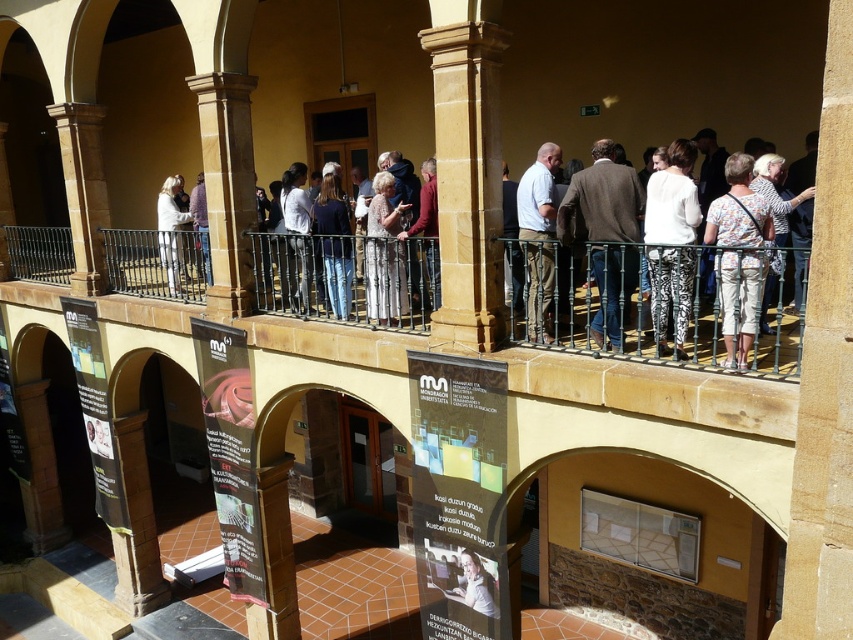
In the scene shown: Which of these two, black wrought iron railing at upper center or floral-patterned dress at center, stands shorter?

With less height is floral-patterned dress at center.

Between point (756, 340) and point (398, 266), which one is positioned in front?

Positioned in front is point (756, 340).

You are a GUI agent. You are given a task and a screenshot of the screen. Output one action in this format:
    pyautogui.click(x=<x>, y=<y>)
    Task: Click on the black wrought iron railing at upper center
    This screenshot has width=853, height=640.
    Given the screenshot: What is the action you would take?
    pyautogui.click(x=294, y=282)

From the picture: Can you confirm if floral-patterned pants at center is shorter than white fabric at upper center?

Indeed, floral-patterned pants at center has a lesser height compared to white fabric at upper center.

Which is behind, point (751, 264) or point (173, 253)?

The point (173, 253) is behind.

Locate an element on the screen. This screenshot has width=853, height=640. floral-patterned pants at center is located at coordinates (738, 209).

Does point (450, 170) lie in front of point (158, 228)?

Yes, point (450, 170) is closer to viewer.

Who is taller, brown stone pillar at center or white fabric at upper center?

brown stone pillar at center is taller.

At what (x,y) coordinates should I click in order to perform the action: click on brown stone pillar at center. Please return your answer as a coordinate pair (x, y). Looking at the image, I should click on (466, 173).